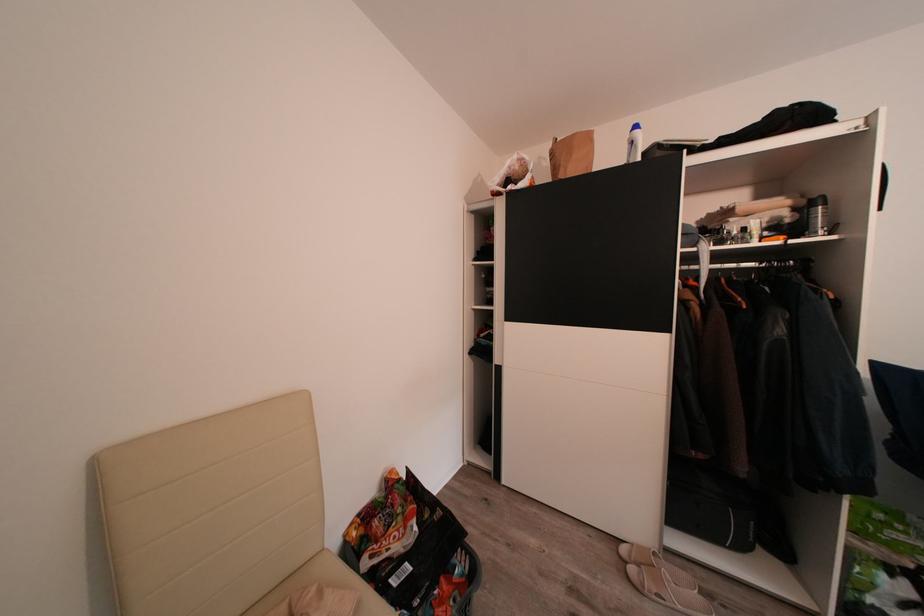
Where is `sliding door edge`? The image size is (924, 616). sliding door edge is located at coordinates 864,124.